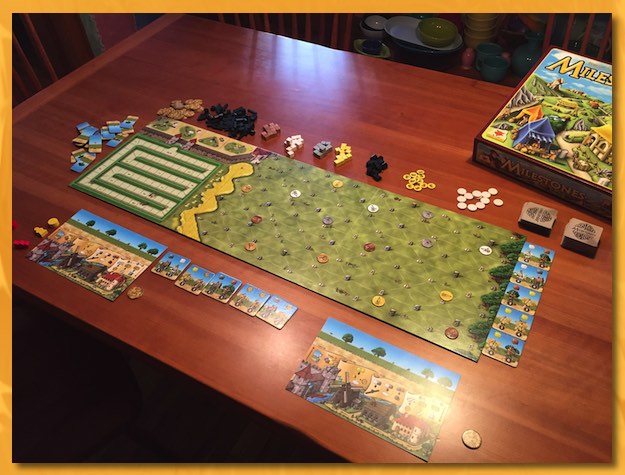
Locate an element on the screen. This screenshot has height=475, width=625. table is located at coordinates (329, 79).